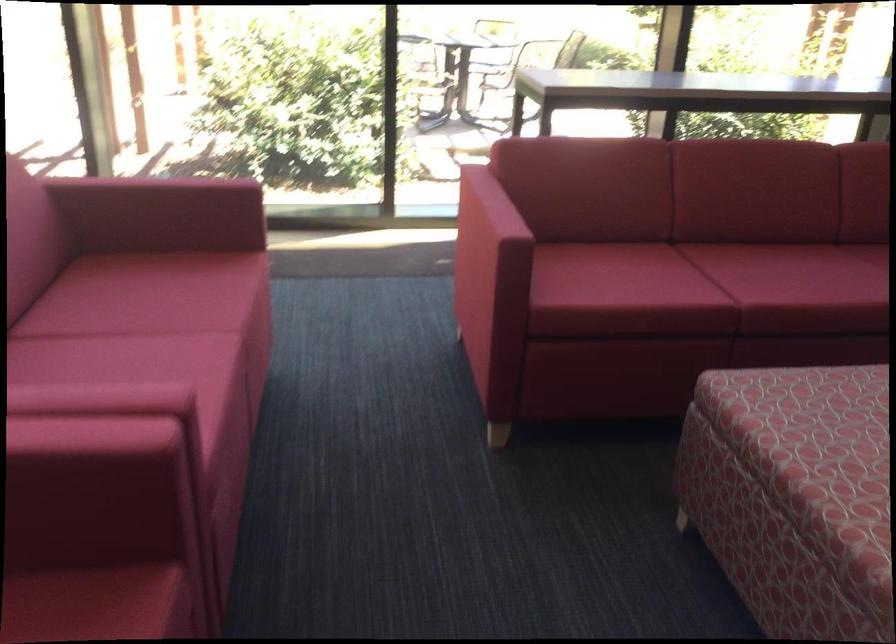
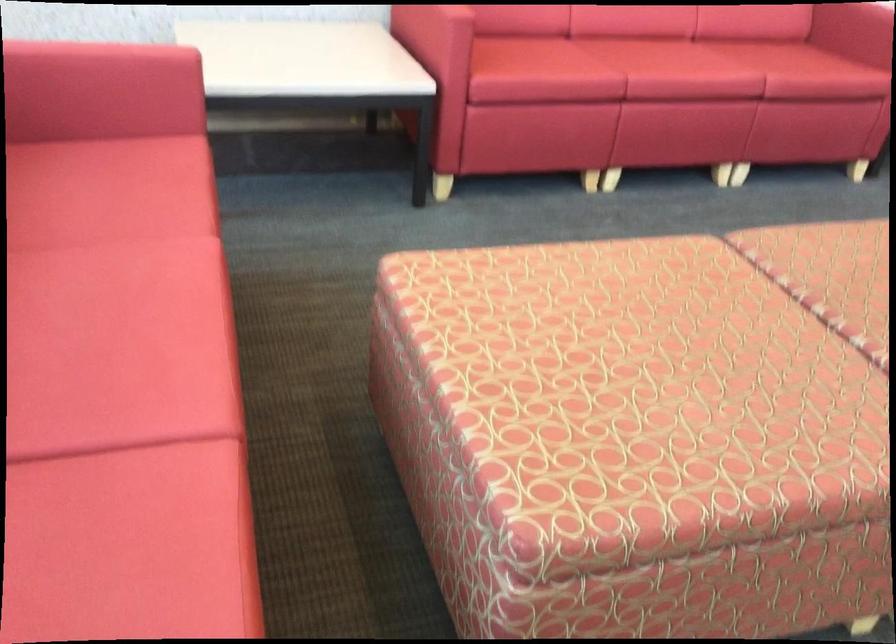
The point at (763, 281) is marked in the first image. Where is the corresponding point in the second image?

(117, 381)